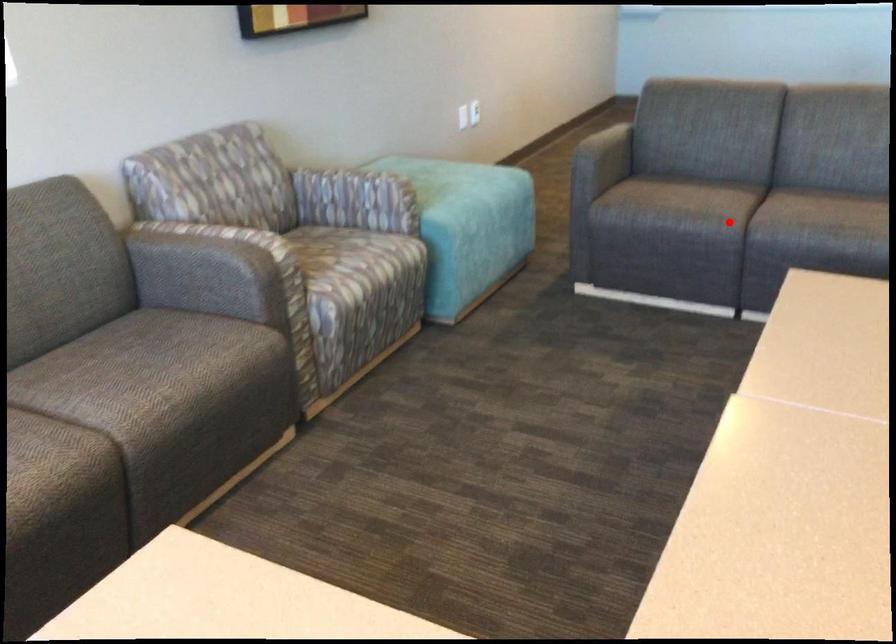
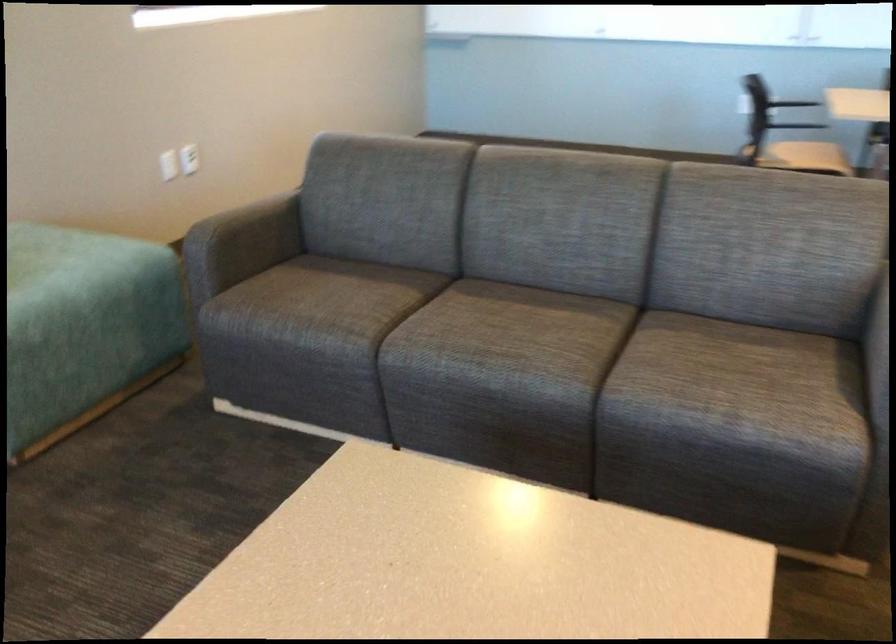
Where in the second image is the point corresponding to the highlighted location from the first image?

(358, 343)